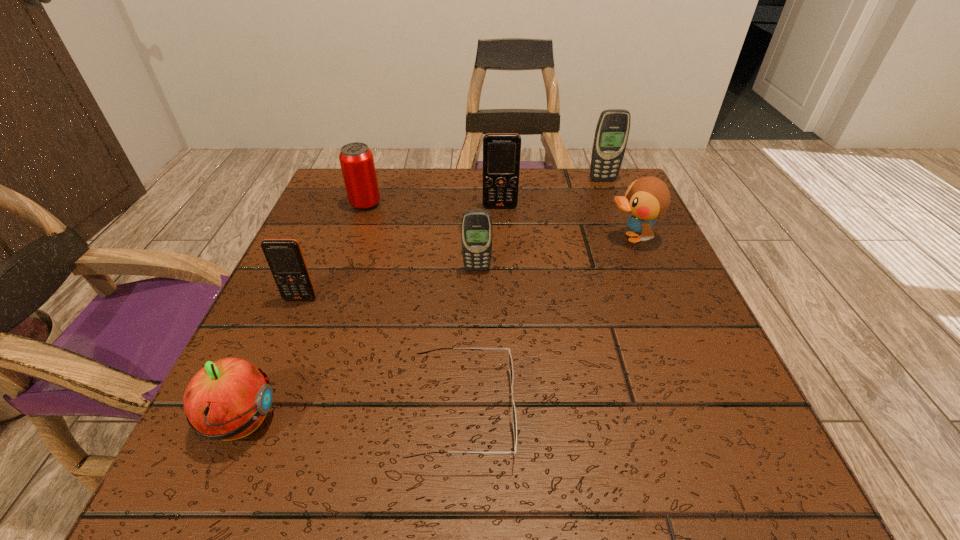
This screenshot has height=540, width=960. What are the coordinates of `the fifth farthest object` in the screenshot? It's located at (476, 228).

Locate an element on the screen. Image resolution: width=960 pixels, height=540 pixels. apple is located at coordinates (228, 399).

Find the location of a particular element. sunglasses is located at coordinates (513, 410).

The width and height of the screenshot is (960, 540). I want to click on blank space located on the screen of the farthest cellular telephone, so click(624, 234).

Locate an element on the screen. vacant space located 0.070m on the screen of the bigger orange cellular telephone is located at coordinates (501, 227).

What are the coordinates of `free spot located on the right of the can` in the screenshot? It's located at (508, 204).

Locate an element on the screen. vacant region located 0.190m on the front-facing side of the blue duck is located at coordinates (516, 238).

Locate an element on the screen. The image size is (960, 540). vacant space located on the front-facing side of the blue duck is located at coordinates (437, 238).

At what (x,y) coordinates should I click in order to perform the action: click on free spot located 0.400m on the front-facing side of the blue duck. Please return your answer as a coordinate pair (x, y). The height and width of the screenshot is (540, 960). Looking at the image, I should click on (419, 238).

You are a GUI agent. You are given a task and a screenshot of the screen. Output one action in this format:
    pyautogui.click(x=<x>, y=<y>)
    Task: Click on the vacant area situated 0.210m on the screen of the third nearest object
    The image size is (960, 540).
    Given the screenshot: What is the action you would take?
    pyautogui.click(x=255, y=404)